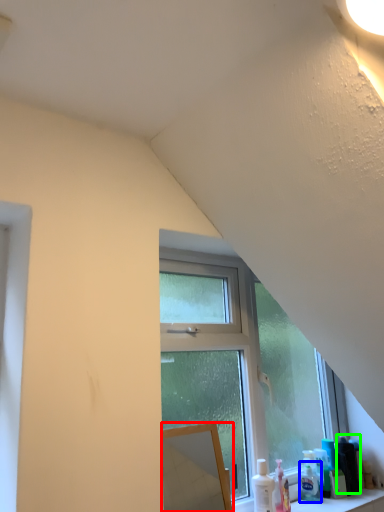
Question: Which object is positioned farthest from mirror (highlighted by a red box)? Select from toiletry (highlighted by a blue box) and toiletry (highlighted by a green box).

Choices:
 (A) toiletry
 (B) toiletry

Answer: (B)